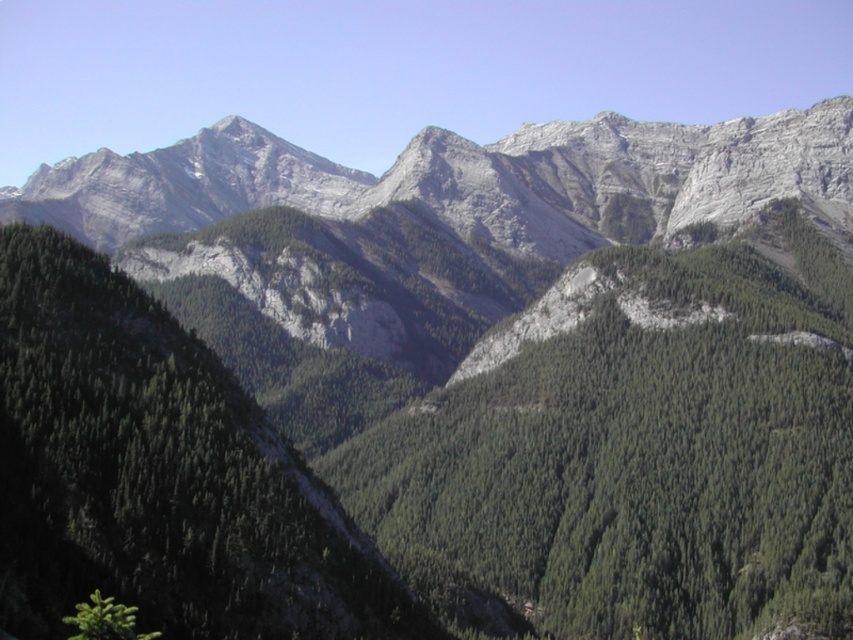
You are a hiker standing at the base of the mountain. You see the gray rocky mountain range at center and the green matte tree at lower left. Which object is closer to you?

The green matte tree at lower left is behind the gray rocky mountain range at center, so the gray rocky mountain range at center is closer to you.

You are a hiker planning to take a photo of the mountain range. You notice two points marked on your map at coordinates point (x=595, y=198) and point (x=73, y=621). Which point is closer to your current position if you are standing at the camera position?

Point (x=73, y=621) is closer to the camera position because it is less further than point (x=595, y=198).

You are a hiker planning to take a photo of the gray rocky mountain range at center and the green matte tree at lower left from a vantage point. Which object should you position to your right side to capture both in the frame?

The gray rocky mountain range at center is to the left of the green matte tree at lower left, so to capture both in the frame, position the green matte tree at lower left to your right side so the gray rocky mountain range at center will be on the left, allowing both to be included in the photo.